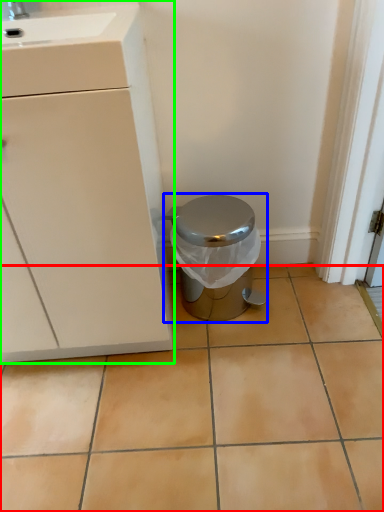
Question: Which object is positioned closest to ceramic tile (highlighted by a red box)? Select from waste container (highlighted by a blue box) and cabinetry (highlighted by a green box).

Choices:
 (A) waste container
 (B) cabinetry

Answer: (A)